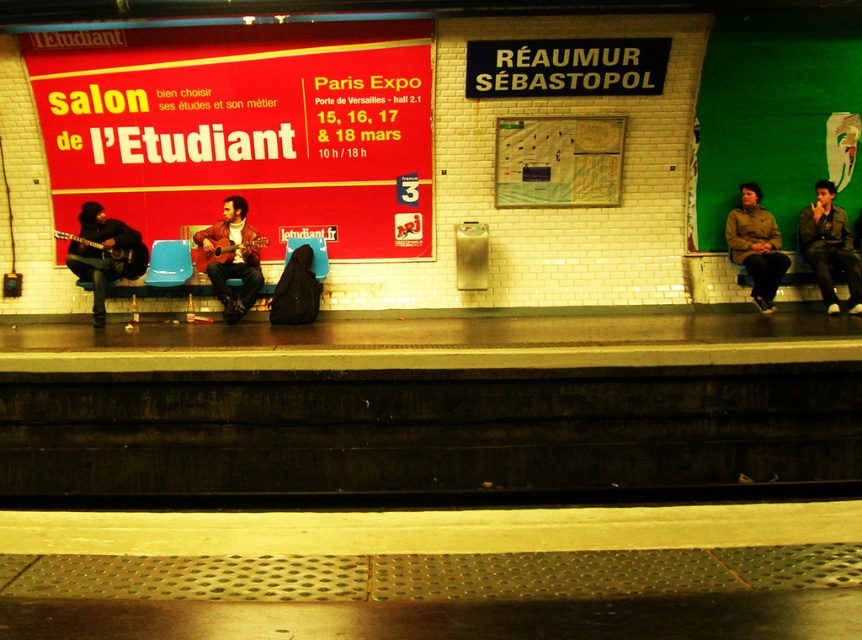
Between black leather jacket at left and green matte jacket at right, which one is positioned higher?

Positioned higher is green matte jacket at right.

Can you confirm if black leather jacket at left is bigger than green matte jacket at right?

No.

Is point (67, 262) closer to viewer compared to point (809, 228)?

Yes, point (67, 262) is closer to viewer.

Find the location of a particular element. Image resolution: width=862 pixels, height=640 pixels. black leather jacket at left is located at coordinates (104, 253).

Between point (832, 248) and point (759, 236), which one is positioned behind?

Positioned behind is point (759, 236).

Is green matte jacket at right closer to camera compared to brown leather jacket at right?

That is True.

Find the location of a particular element. green matte jacket at right is located at coordinates (829, 246).

Image resolution: width=862 pixels, height=640 pixels. Identify the location of green matte jacket at right. (829, 246).

Can you confirm if brown leather jacket at right is bigger than leather jacket at center?

Actually, brown leather jacket at right might be smaller than leather jacket at center.

Does brown leather jacket at right have a smaller size compared to leather jacket at center?

Yes, brown leather jacket at right is smaller than leather jacket at center.

This screenshot has height=640, width=862. Find the location of `brown leather jacket at right`. brown leather jacket at right is located at coordinates (756, 244).